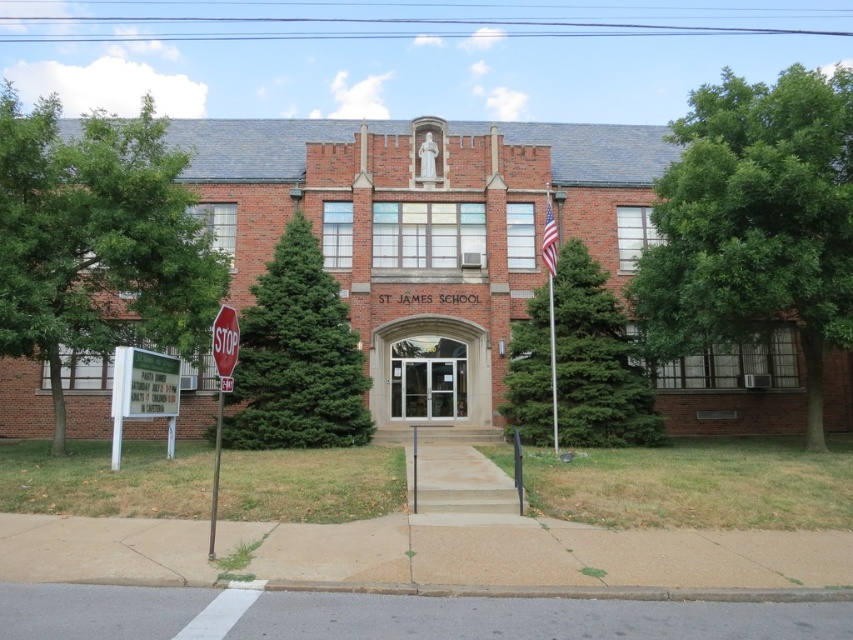
Based on the photo, you are a visitor arriving at St. James School. You see a green leafy tree at left and a green fir tree at left. Which tree is closer to the entrance of the school?

The green leafy tree at left is positioned over the green fir tree at left, meaning it is closer to the entrance of the school.

You are standing in front of St. James School and want to locate two specific points marked on the building. The first point is at coordinate point (582, 308) and the second is at point (213, 484). Which point is closer to the entrance?

Point (213, 484) is closer to the entrance because it is in front of point (582, 308).